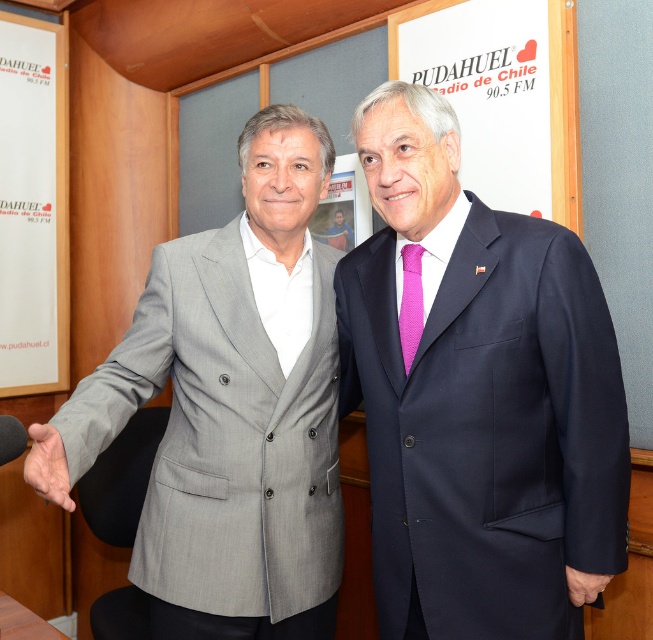
You are a photographer positioned at the origin point. You need to capture a closeup of the dark blue suit at center. Which direction should you move your camera to focus on it?

The dark blue suit at center is located at point 0.617 on the x axis and 0.732 on the y axis, so you should move your camera to the right and upwards to focus on it.

Based on the coordinates provided, which object is located at point (477, 394) in the image?

The point (477, 394) corresponds to the dark blue suit at center.